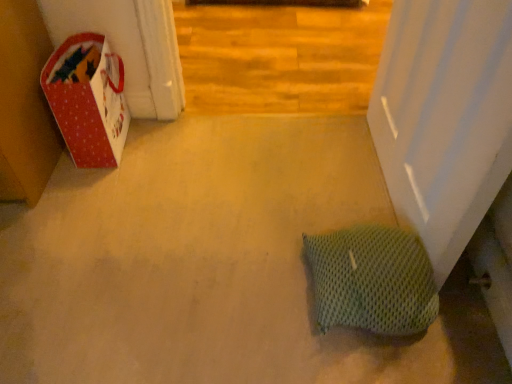
This screenshot has width=512, height=384. What do you see at coordinates (88, 99) in the screenshot?
I see `red paper bag at left` at bounding box center [88, 99].

Find the location of a particular element. This screenshot has width=512, height=384. red paper bag at left is located at coordinates (88, 99).

Find the location of `green mesh pillow at lower right`. green mesh pillow at lower right is located at coordinates (372, 280).

What do you see at coordinates (372, 280) in the screenshot?
I see `green mesh pillow at lower right` at bounding box center [372, 280].

Find the location of a particular element. The height and width of the screenshot is (384, 512). red paper bag at left is located at coordinates (88, 99).

Considering the positions of objects green mesh pillow at lower right and red paper bag at left in the image provided, who is more to the right, green mesh pillow at lower right or red paper bag at left?

Positioned to the right is green mesh pillow at lower right.

Considering the relative positions of green mesh pillow at lower right and red paper bag at left in the image provided, is green mesh pillow at lower right behind red paper bag at left?

No, green mesh pillow at lower right is closer to the viewer.

Which point is more forward, (379, 322) or (63, 46)?

The point (379, 322) is closer.

From the image's perspective, is green mesh pillow at lower right over red paper bag at left?

Incorrect, from the image's perspective, green mesh pillow at lower right is lower than red paper bag at left.

Based on the photo, from a real-world perspective, is green mesh pillow at lower right physically located above or below red paper bag at left?

From a real-world perspective, green mesh pillow at lower right is physically below red paper bag at left.

Considering the sizes of green mesh pillow at lower right and red paper bag at left in the image, is green mesh pillow at lower right wider or thinner than red paper bag at left?

Considering their sizes, green mesh pillow at lower right looks slimmer than red paper bag at left.

Considering the sizes of objects green mesh pillow at lower right and red paper bag at left in the image provided, who is taller, green mesh pillow at lower right or red paper bag at left?

red paper bag at left is taller.

Who is smaller, green mesh pillow at lower right or red paper bag at left?

Smaller between the two is green mesh pillow at lower right.

Is green mesh pillow at lower right spatially inside red paper bag at left, or outside of it?

The correct answer is: outside.

Is green mesh pillow at lower right far away from red paper bag at left?

green mesh pillow at lower right is actually quite close to red paper bag at left.

Is green mesh pillow at lower right facing away from red paper bag at left?

No, green mesh pillow at lower right is not facing away from red paper bag at left.

Based on the photo, can you tell me how much green mesh pillow at lower right and red paper bag at left differ in facing direction?

They differ by 87.3 degrees in their facing directions.

Measure the distance between green mesh pillow at lower right and red paper bag at left.

A distance of 33.83 inches exists between green mesh pillow at lower right and red paper bag at left.

At what (x,y) coordinates should I click in order to perform the action: click on cardboard box located above the green mesh pillow at lower right (from a real-world perspective). Please return your answer as a coordinate pair (x, y). Looking at the image, I should click on (88, 99).

Is red paper bag at left at the right side of green mesh pillow at lower right?

In fact, red paper bag at left is to the left of green mesh pillow at lower right.

Between red paper bag at left and green mesh pillow at lower right, which one is positioned in front?

Positioned in front is green mesh pillow at lower right.

Is point (49, 82) behind point (361, 314)?

Yes, point (49, 82) is farther from viewer.

From the image's perspective, is red paper bag at left above or below green mesh pillow at lower right?

red paper bag at left is above green mesh pillow at lower right.

From the picture: From a real-world perspective, between red paper bag at left and green mesh pillow at lower right, who is vertically higher?

In real-world perspective, red paper bag at left is above.

Which of these two, red paper bag at left or green mesh pillow at lower right, is thinner?

With smaller width is green mesh pillow at lower right.

Does red paper bag at left have a greater height compared to green mesh pillow at lower right?

Yes.

Is red paper bag at left bigger than green mesh pillow at lower right?

Correct, red paper bag at left is larger in size than green mesh pillow at lower right.

Is red paper bag at left completely or partially outside of green mesh pillow at lower right?

Yes, red paper bag at left is located beyond the bounds of green mesh pillow at lower right.

Would you consider red paper bag at left to be distant from green mesh pillow at lower right?

No.

Could you tell me if red paper bag at left is turned towards green mesh pillow at lower right?

No, red paper bag at left is not facing towards green mesh pillow at lower right.

How many degrees apart are the facing directions of red paper bag at left and green mesh pillow at lower right?

87.3 degrees.

The height and width of the screenshot is (384, 512). I want to click on pillow located below the red paper bag at left (from the image's perspective), so click(372, 280).

Locate an element on the screen. pillow on the right of red paper bag at left is located at coordinates (372, 280).

Where is `cardboard box behind the green mesh pillow at lower right`? The width and height of the screenshot is (512, 384). cardboard box behind the green mesh pillow at lower right is located at coordinates (88, 99).